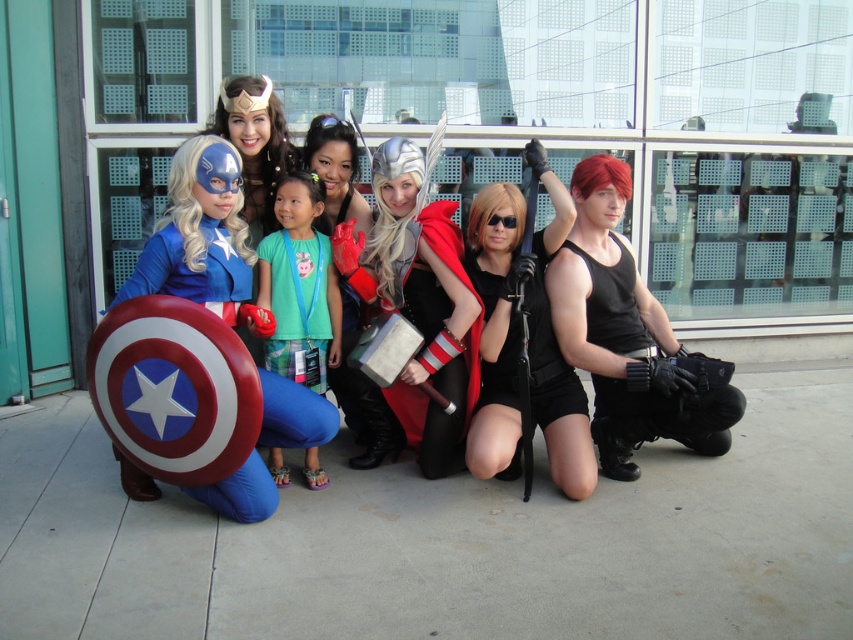
Is the position of matte blue costume at lower left more distant than that of green fabric shirt at center?

That is False.

Does matte blue costume at lower left appear on the left side of green fabric shirt at center?

Yes, matte blue costume at lower left is to the left of green fabric shirt at center.

Where is `matte blue costume at lower left`? The width and height of the screenshot is (853, 640). matte blue costume at lower left is located at coordinates (200, 236).

Is black matte/leather jacket at center closer to the viewer compared to silver metallic hammer at center?

Yes, it is in front of silver metallic hammer at center.

Can you confirm if black matte/leather jacket at center is positioned to the left of silver metallic hammer at center?

Incorrect, black matte/leather jacket at center is not on the left side of silver metallic hammer at center.

Who is more distant from viewer, [547,228] or [368,284]?

Point [368,284]

Find the location of a particular element. This screenshot has height=640, width=853. black matte/leather jacket at center is located at coordinates (527, 339).

Is black matte/leather jacket at center positioned behind green fabric shirt at center?

No, black matte/leather jacket at center is in front of green fabric shirt at center.

Can you confirm if black matte/leather jacket at center is wider than green fabric shirt at center?

Yes.

What do you see at coordinates (527, 339) in the screenshot? Image resolution: width=853 pixels, height=640 pixels. I see `black matte/leather jacket at center` at bounding box center [527, 339].

You are a GUI agent. You are given a task and a screenshot of the screen. Output one action in this format:
    pyautogui.click(x=<x>, y=<y>)
    Task: Click on the black matte/leather jacket at center
    The width and height of the screenshot is (853, 640).
    Given the screenshot: What is the action you would take?
    pyautogui.click(x=527, y=339)